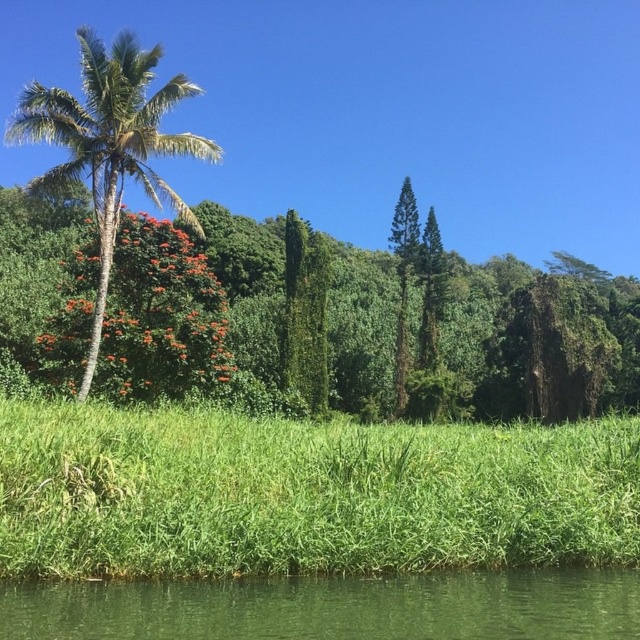
Does point (13, 416) come farther from viewer compared to point (195, 138)?

No, it is not.

Can you confirm if green leafy grass at lower center is thinner than green leafy palm tree at left?

No, green leafy grass at lower center is not thinner than green leafy palm tree at left.

Who is more distant from viewer, [477,492] or [33,132]?

The point [33,132] is more distant.

This screenshot has width=640, height=640. In order to click on green leafy grass at lower center in this screenshot , I will do pyautogui.click(x=305, y=493).

Can you confirm if green leafy tree at left is taller than green smooth water at lower center?

Yes.

Who is more forward, [152,260] or [467,621]?

Point [467,621] is more forward.

The image size is (640, 640). Find the location of `green leafy tree at left`. green leafy tree at left is located at coordinates (364, 323).

Which is more to the left, green leafy tree at left or green leafy grass at lower center?

green leafy grass at lower center is more to the left.

Is green leafy tree at left taller than green leafy grass at lower center?

Correct, green leafy tree at left is much taller as green leafy grass at lower center.

Between point (257, 252) and point (557, 480), which one is positioned behind?

The point (257, 252) is behind.

Identify the location of green leafy tree at left. Image resolution: width=640 pixels, height=640 pixels. (364, 323).